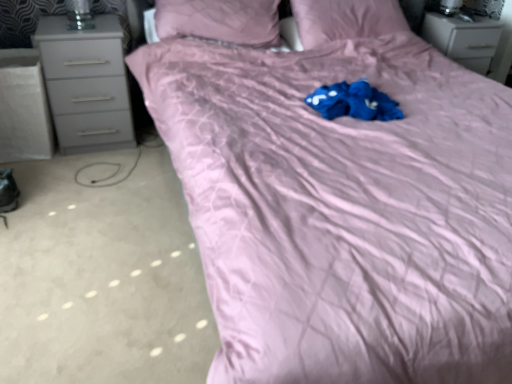
Question: From a real-world perspective, is matte pink pillow at upper center, which ranks as the 2th pillow in left-to-right order, below gray matte chest of drawers at left, acting as the second chest of drawers starting from the right?

Choices:
 (A) yes
 (B) no

Answer: (B)

Question: Considering the relative sizes of matte pink pillow at upper center, which ranks as the 2th pillow in left-to-right order, and gray matte chest of drawers at left, which is counted as the second chest of drawers, starting from the back, in the image provided, is matte pink pillow at upper center, which ranks as the 2th pillow in left-to-right order, shorter than gray matte chest of drawers at left, which is counted as the second chest of drawers, starting from the back,?

Choices:
 (A) no
 (B) yes

Answer: (B)

Question: Does matte pink pillow at upper center, positioned as the first pillow in right-to-left order, appear on the right side of gray matte chest of drawers at left, acting as the second chest of drawers starting from the right?

Choices:
 (A) yes
 (B) no

Answer: (A)

Question: From a real-world perspective, is matte pink pillow at upper center, which ranks as the 2th pillow in left-to-right order, located higher than gray matte chest of drawers at left, placed as the 1th chest of drawers when sorted from left to right?

Choices:
 (A) no
 (B) yes

Answer: (B)

Question: Is gray matte chest of drawers at left, the first chest of drawers in the front-to-back sequence, at the back of matte pink pillow at upper center, which ranks as the 2th pillow in left-to-right order?

Choices:
 (A) yes
 (B) no

Answer: (B)

Question: Would you say matte pink pillow at upper center, positioned as the first pillow in right-to-left order, contains gray matte chest of drawers at left, placed as the 1th chest of drawers when sorted from left to right?

Choices:
 (A) yes
 (B) no

Answer: (B)

Question: Is matte pink pillow at upper center, which is the first pillow in left-to-right order, wider than matte pink pillow at upper center, positioned as the first pillow in right-to-left order?

Choices:
 (A) yes
 (B) no

Answer: (A)

Question: From a real-world perspective, is matte pink pillow at upper center, which is the first pillow in left-to-right order, positioned under matte pink pillow at upper center, positioned as the first pillow in right-to-left order, based on gravity?

Choices:
 (A) yes
 (B) no

Answer: (B)

Question: Can you confirm if matte pink pillow at upper center, the second pillow positioned from the right, is positioned to the right of matte pink pillow at upper center, positioned as the first pillow in right-to-left order?

Choices:
 (A) no
 (B) yes

Answer: (A)

Question: Is matte pink pillow at upper center, which ranks as the 2th pillow in left-to-right order, surrounded by matte pink pillow at upper center, the second pillow positioned from the right?

Choices:
 (A) no
 (B) yes

Answer: (A)

Question: Is matte pink pillow at upper center, the second pillow positioned from the right, not close to matte pink pillow at upper center, positioned as the first pillow in right-to-left order?

Choices:
 (A) no
 (B) yes

Answer: (A)

Question: Considering the relative sizes of matte pink pillow at upper center, the second pillow positioned from the right, and matte pink pillow at upper center, which ranks as the 2th pillow in left-to-right order, in the image provided, is matte pink pillow at upper center, the second pillow positioned from the right, taller than matte pink pillow at upper center, which ranks as the 2th pillow in left-to-right order,?

Choices:
 (A) no
 (B) yes

Answer: (B)

Question: Can you confirm if gray matte chest of drawers at left, which is counted as the second chest of drawers, starting from the back, is bigger than matte pink pillow at upper center, which is the first pillow in left-to-right order?

Choices:
 (A) yes
 (B) no

Answer: (B)